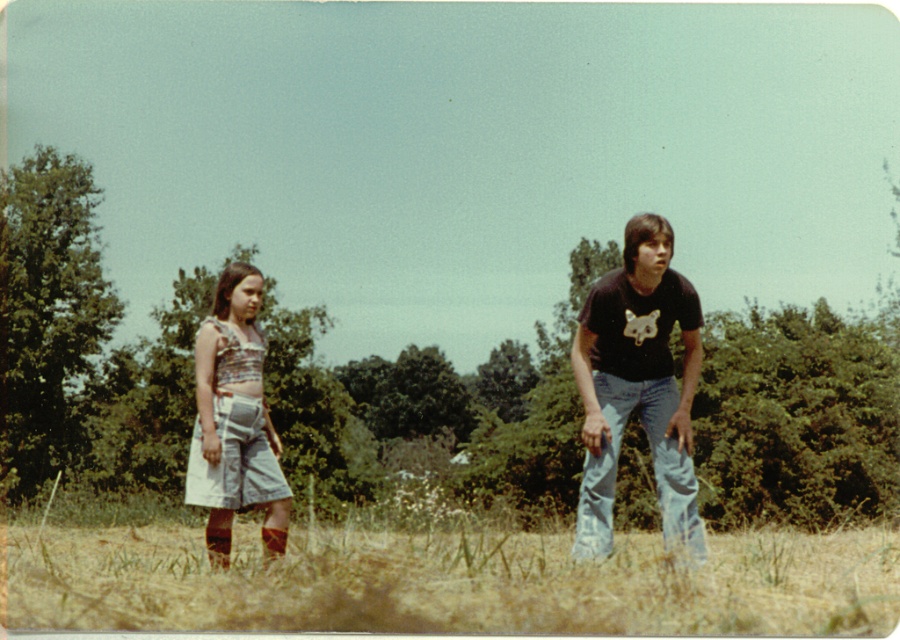
You are planning to set up a picnic blanket in the grassy field at lower center. Considering the presence of the black cotton shirt at right, which is part of the young man in the scene, will there be enough space to place the blanket without overlapping any objects?

The grassy field at lower center might be wider than the black cotton shirt at right, so there is likely enough space to place the picnic blanket without overlapping any objects.

You are planning to take a photo of the black cotton shirt at right and the grassy field at lower center. Which object should be in focus first if you want to capture both clearly?

The grassy field at lower center is in front of the black cotton shirt at right, so you should focus on the grassy field at lower center first to ensure both are in focus.

You are trying to locate the black cotton shirt at right in the image. Based on the coordinates provided, where exactly should you look?

The black cotton shirt at right is located at point 0.603 on the x axis and 0.709 on the y axis.